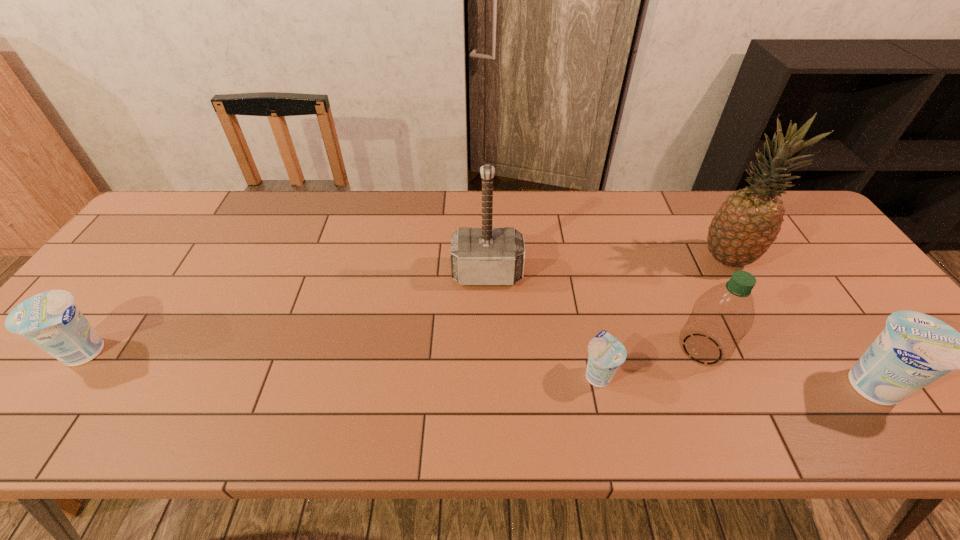
Identify the location of free space between the second tallest yogurt and the fifth object from right to left. This screenshot has height=540, width=960. (287, 313).

The width and height of the screenshot is (960, 540). Identify the location of vacant space that is in between the second tallest yogurt and the shortest yogurt. (343, 363).

The image size is (960, 540). I want to click on free space between the leftmost object and the second tallest object, so click(287, 313).

At what (x,y) coordinates should I click in order to perform the action: click on free space between the third object from right to left and the second yogurt from right to left. Please return your answer as a coordinate pair (x, y). Looking at the image, I should click on click(650, 361).

Find the location of a particular element. This screenshot has width=960, height=540. object that is the second nearest to the second tallest object is located at coordinates (721, 317).

Image resolution: width=960 pixels, height=540 pixels. Identify the location of object that stands as the second closest to the second object from left to right. (721, 317).

Select which yogurt is the third closest to the pineapple. Please provide its 2D coordinates. Your answer should be formatted as a tuple, i.e. [(x, y)], where the tuple contains the x and y coordinates of a point satisfying the conditions above.

[(51, 320)]

Select which yogurt is the second closest to the rightmost yogurt. Please provide its 2D coordinates. Your answer should be formatted as a tuple, i.e. [(x, y)], where the tuple contains the x and y coordinates of a point satisfying the conditions above.

[(51, 320)]

Identify the location of free location that satisfies the following two spatial constraints: 1. for striking with the head of the fifth object from right to left; 2. on the left side of the rightmost yogurt. (489, 386).

Locate an element on the screen. free point that satisfies the following two spatial constraints: 1. on the front side of the leftmost yogurt; 2. on the right side of the shortest yogurt is located at coordinates (71, 374).